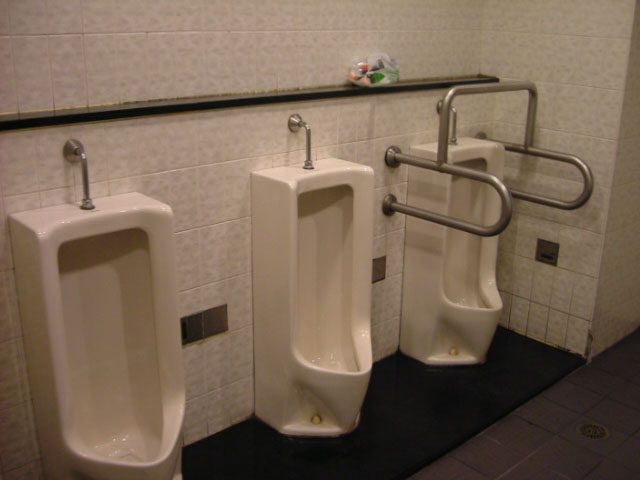
This screenshot has width=640, height=480. I want to click on metal fixtures in bathroom, so point(84,164), point(308,129), point(481,88), point(461,168), point(556,151), point(454,120).